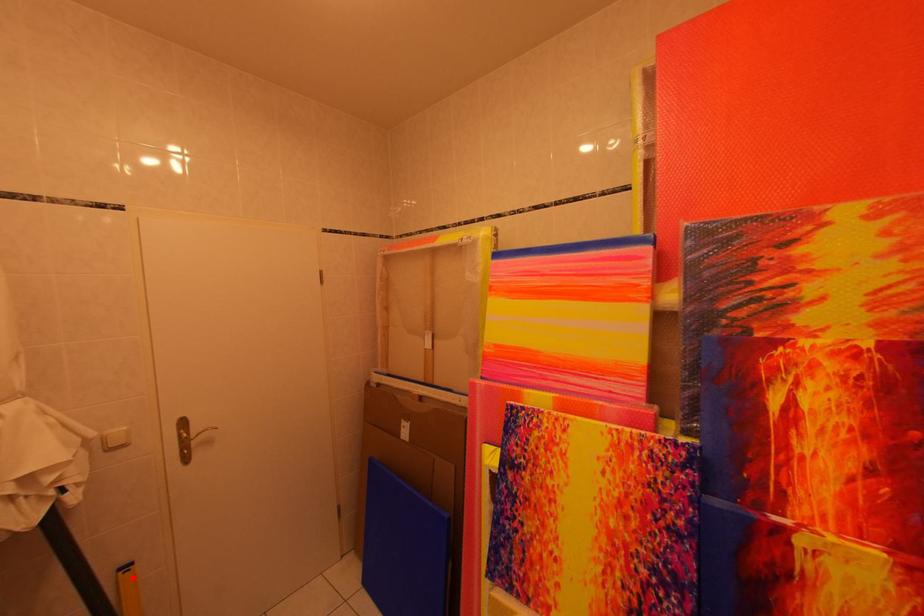
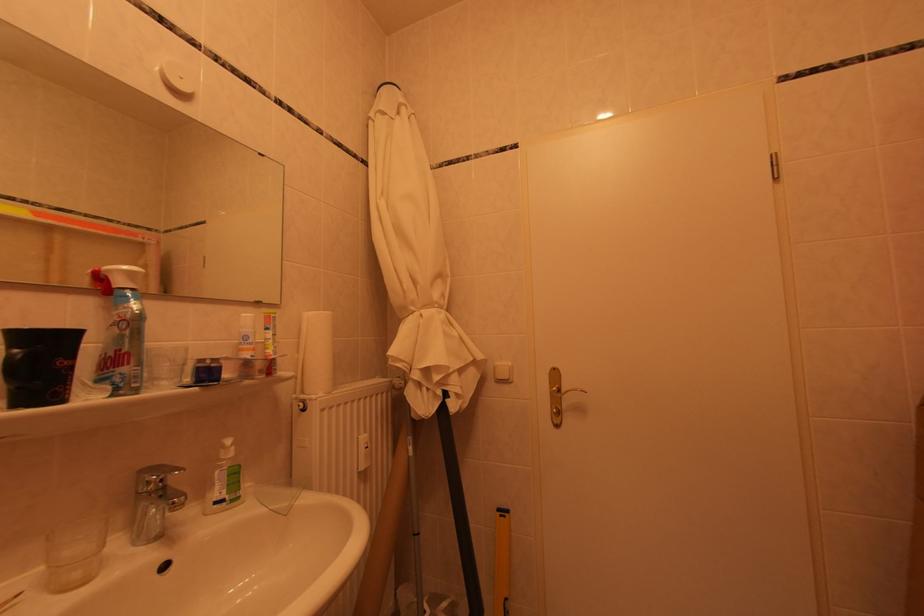
Where in the second image is the point corresponding to the highlighted location from the first image?

(509, 519)